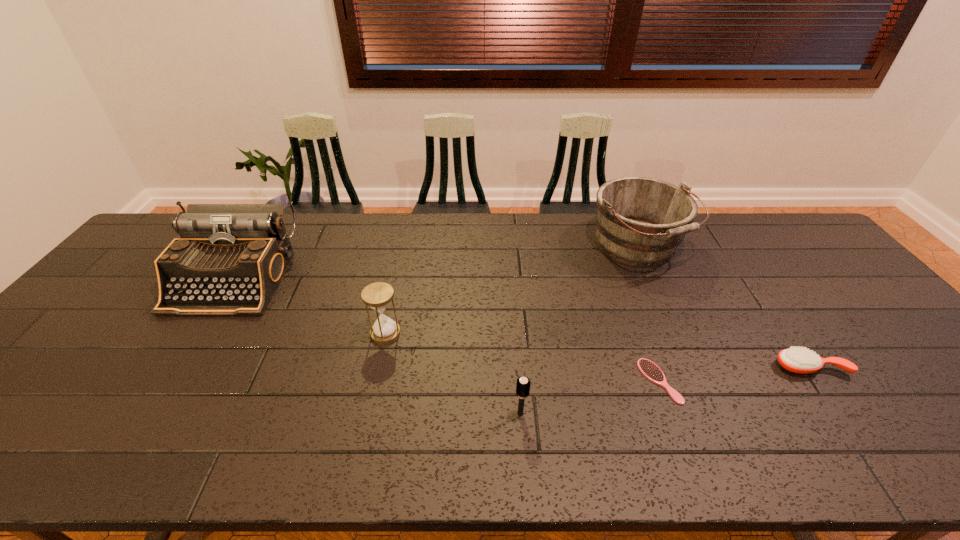
Find the location of `vacant space at the right edge of the desktop`. vacant space at the right edge of the desktop is located at coordinates (905, 382).

In order to click on free space at the far right corner in this screenshot , I will do `click(741, 213)`.

Find the location of `empty space between the rightmost hairbrush and the wine bucket`. empty space between the rightmost hairbrush and the wine bucket is located at coordinates (724, 306).

Identify the location of free point between the leftmost object and the rightmost hairbrush. The image size is (960, 540). 521,323.

Locate an element on the screen. The image size is (960, 540). unoccupied position between the wine bucket and the rightmost object is located at coordinates (724, 306).

Where is `free space that is in between the second object from left to right and the nearest hairbrush`? This screenshot has width=960, height=540. free space that is in between the second object from left to right and the nearest hairbrush is located at coordinates (453, 374).

This screenshot has width=960, height=540. Identify the location of free point between the hourglass and the shortest object. (522, 357).

In order to click on vacant region between the second hairbrush from right to left and the typewriter in this screenshot , I will do `click(446, 330)`.

You are a GUI agent. You are given a task and a screenshot of the screen. Output one action in this format:
    pyautogui.click(x=<x>, y=<y>)
    Task: Click on the unoccupied area between the nearest object and the fifth object from right to left
    This screenshot has height=540, width=960.
    Given the screenshot: What is the action you would take?
    pyautogui.click(x=453, y=374)

Find the location of `free space between the rightmost hairbrush and the leftmost object`. free space between the rightmost hairbrush and the leftmost object is located at coordinates (521, 323).